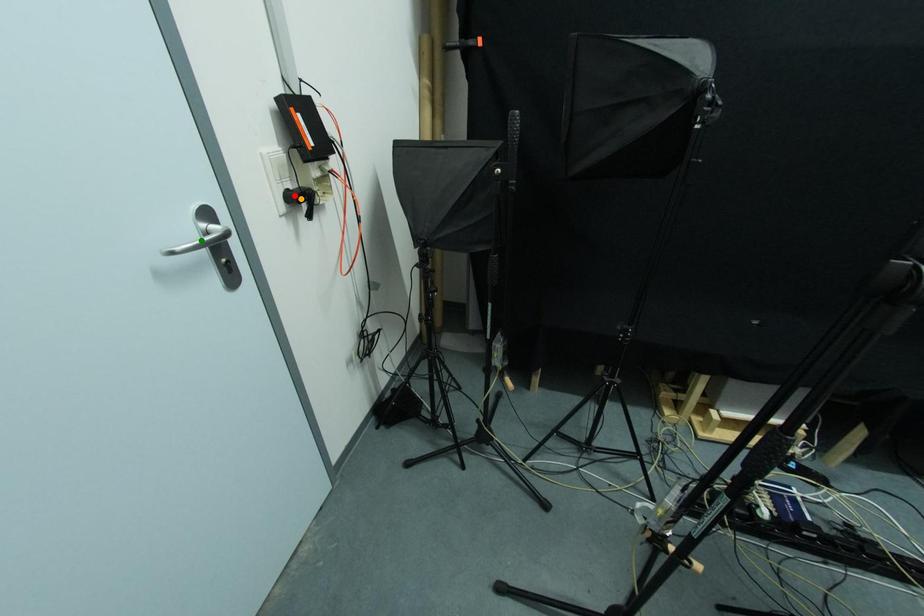
Order these from farthest to nearest:
red point, orange point, green point

orange point
red point
green point